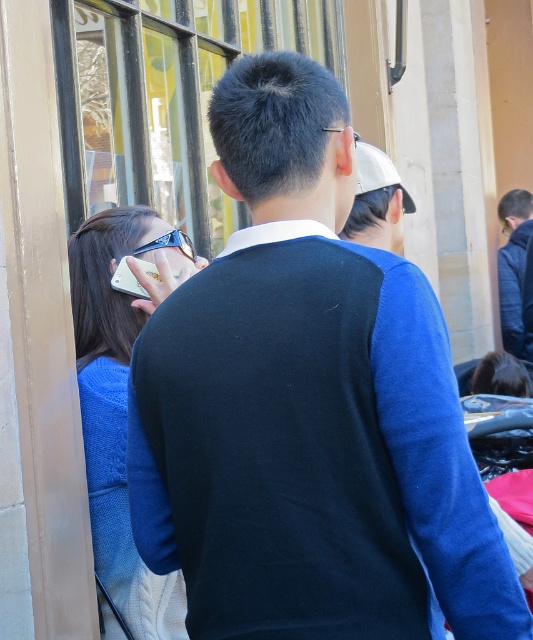
Question: Which point is farther from the camera taking this photo?

Choices:
 (A) (163, 362)
 (B) (86, 426)
 (C) (379, 154)
 (D) (496, 208)

Answer: (D)

Question: Among these objects, which one is nearest to the camera?

Choices:
 (A) white matte cap at upper center
 (B) satin blue sweater at left

Answer: (B)

Question: Which object is farther from the camera taking this photo?

Choices:
 (A) white matte phone at upper center
 (B) white matte cap at upper center

Answer: (B)

Question: Can you confirm if white matte cap at upper center is positioned below white matte phone at upper center?

Choices:
 (A) yes
 (B) no

Answer: (B)

Question: Is satin blue sweater at left closer to camera compared to white matte cap at upper center?

Choices:
 (A) no
 (B) yes

Answer: (B)

Question: Is satin blue sweater at left further to camera compared to dark blue fabric jacket at upper right?

Choices:
 (A) yes
 (B) no

Answer: (B)